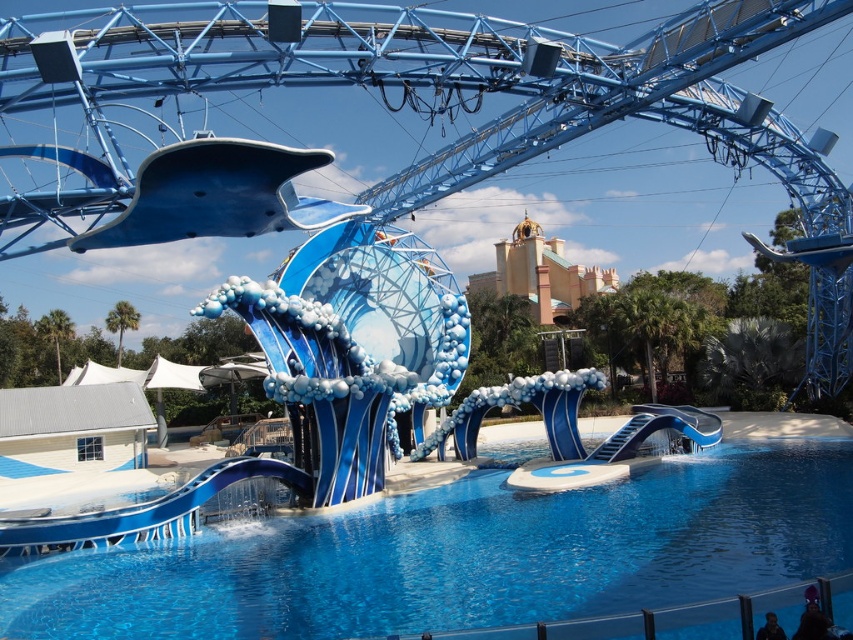
In the scene shown: Between transparent glass pool at center and glossy blue whale at upper center, which one has more height?

Standing taller between the two is glossy blue whale at upper center.

Does transparent glass pool at center appear under glossy blue whale at upper center?

Yes, transparent glass pool at center is below glossy blue whale at upper center.

Is point (554, 577) positioned before point (357, 205)?

That is True.

Where is `transparent glass pool at center`? transparent glass pool at center is located at coordinates (466, 556).

Measure the distance between glossy blue whale at upper center and glossy plastic slide at lower left.

glossy blue whale at upper center and glossy plastic slide at lower left are 64.11 feet apart.

Is glossy blue whale at upper center below glossy plastic slide at lower left?

No, glossy blue whale at upper center is not below glossy plastic slide at lower left.

Identify the location of glossy blue whale at upper center. (218, 195).

Is transparent glass pool at center below glossy plastic slide at lower left?

Indeed, transparent glass pool at center is positioned under glossy plastic slide at lower left.

Which is more to the right, transparent glass pool at center or glossy plastic slide at lower left?

Positioned to the right is transparent glass pool at center.

Is point (567, 499) farther from camera compared to point (73, 540)?

Yes.

Identify the location of transparent glass pool at center. Image resolution: width=853 pixels, height=640 pixels. (466, 556).